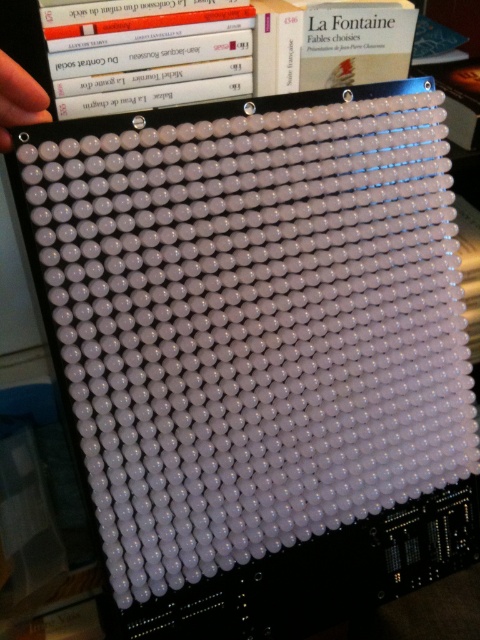
You are trying to place both the hardcover book at upper center and the white matte hand at upper left onto a shelf. Which object requires more space on the shelf?

The hardcover book at upper center requires more space on the shelf because it is bigger than the white matte hand at upper left.

What are the coordinates of the hardcover book at upper center in the image?

The hardcover book at upper center is located at coordinates point (227, 52).

You are an assistant organizing a library shelf. You see a hardcover book at upper center and a white matte hand at upper left. Which object is positioned to the right side of the shelf?

The hardcover book at upper center is to the right of the white matte hand at upper left, so the hardcover book at upper center is positioned to the right side of the shelf.